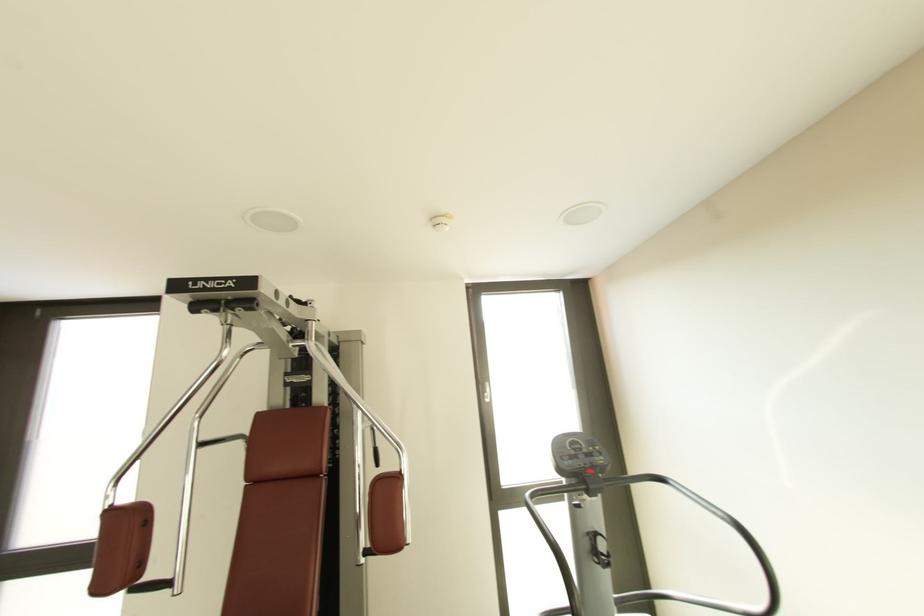
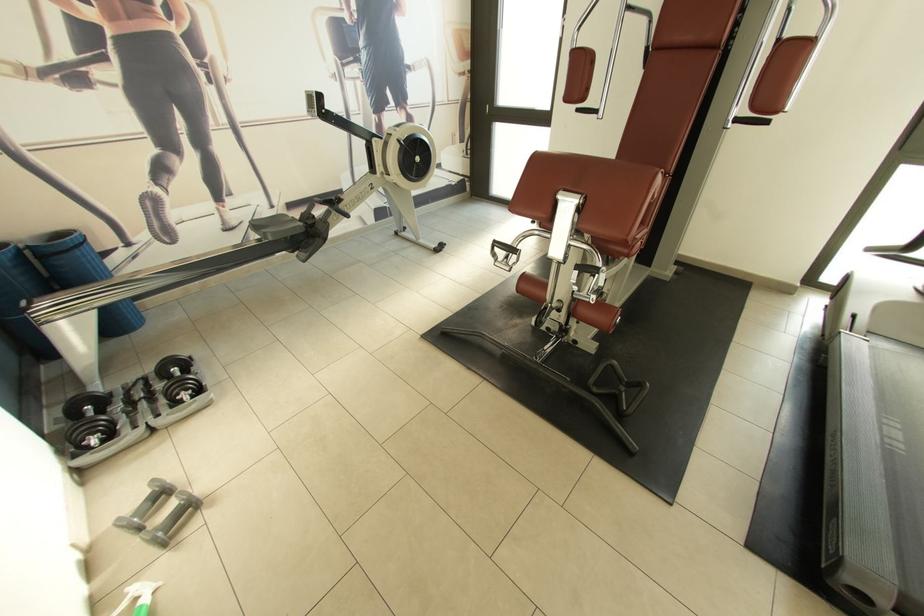
The point at (371, 554) is marked in the first image. Where is the corresponding point in the second image?

(742, 121)